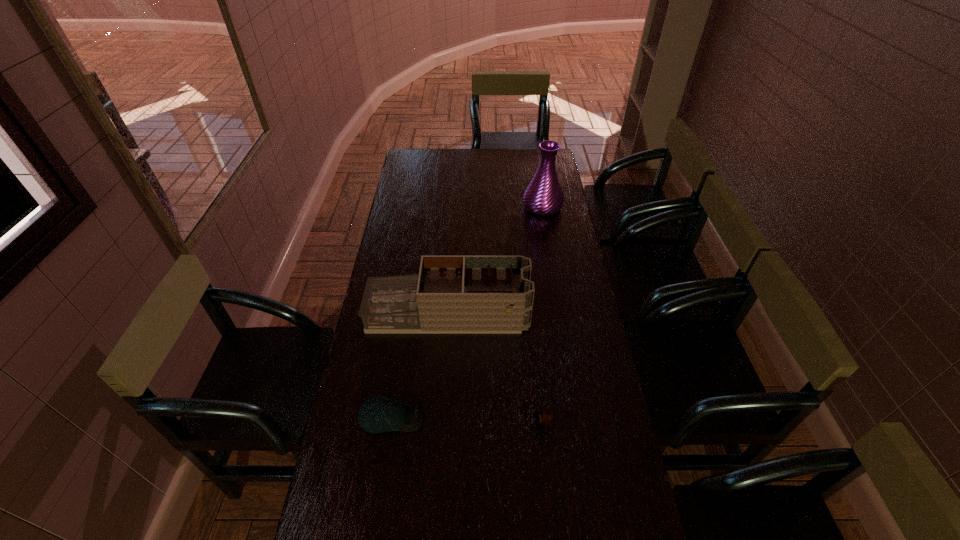
Identify the location of free space located 0.280m on the front-facing side of the teddy bear. (441, 423).

The image size is (960, 540). Identify the location of vacant space located on the back of the baseball cap. (401, 354).

At what (x,y) coordinates should I click in order to perform the action: click on dollhouse located in the left edge section of the desktop. Please return your answer as a coordinate pair (x, y). Looking at the image, I should click on (451, 294).

Locate an element on the screen. The height and width of the screenshot is (540, 960). baseball cap that is positioned at the left edge is located at coordinates (379, 414).

Where is `object that is positioned at the right edge`? object that is positioned at the right edge is located at coordinates pyautogui.click(x=543, y=196).

Locate an element on the screen. The image size is (960, 540). vacant space at the far edge of the desktop is located at coordinates (514, 165).

Locate an element on the screen. free space at the left edge is located at coordinates (391, 249).

At what (x,y) coordinates should I click in order to perform the action: click on free space at the right edge of the desktop. Please return your answer as a coordinate pair (x, y). The image size is (960, 540). Looking at the image, I should click on (544, 222).

Find the location of `free space at the far left corner`. free space at the far left corner is located at coordinates (424, 170).

Find the location of `free spot between the third nearest object and the baseball cap`. free spot between the third nearest object and the baseball cap is located at coordinates (420, 366).